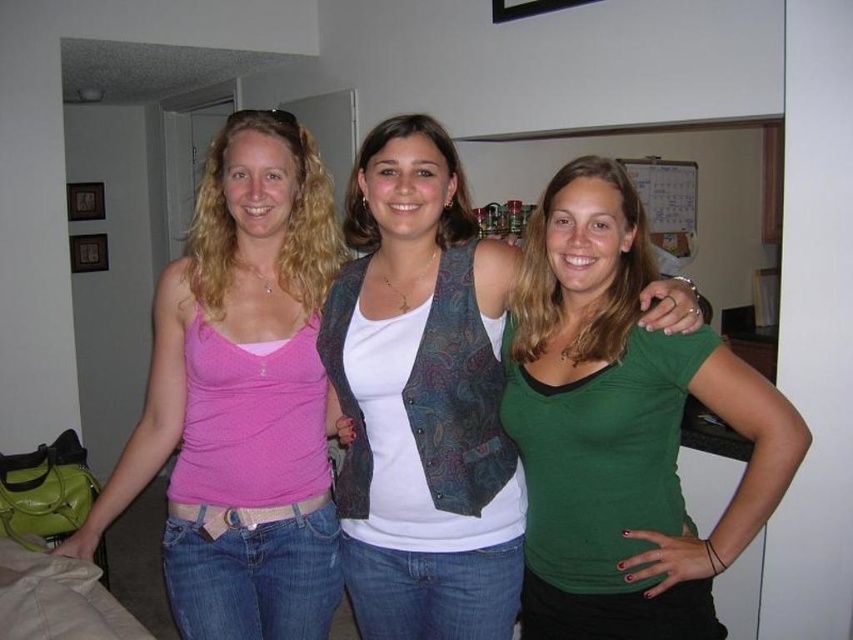
Question: Can you confirm if pink matte tank top at left is positioned above green matte shirt at center?

Choices:
 (A) no
 (B) yes

Answer: (B)

Question: Which object is closer to the camera taking this photo?

Choices:
 (A) pink matte tank top at left
 (B) green matte shirt at center

Answer: (B)

Question: Can you confirm if pink matte tank top at left is bigger than green matte shirt at center?

Choices:
 (A) no
 (B) yes

Answer: (B)

Question: Is pink matte tank top at left wider than green matte shirt at center?

Choices:
 (A) no
 (B) yes

Answer: (B)

Question: Which point is closer to the camera?

Choices:
 (A) (125, 460)
 (B) (581, 352)

Answer: (B)